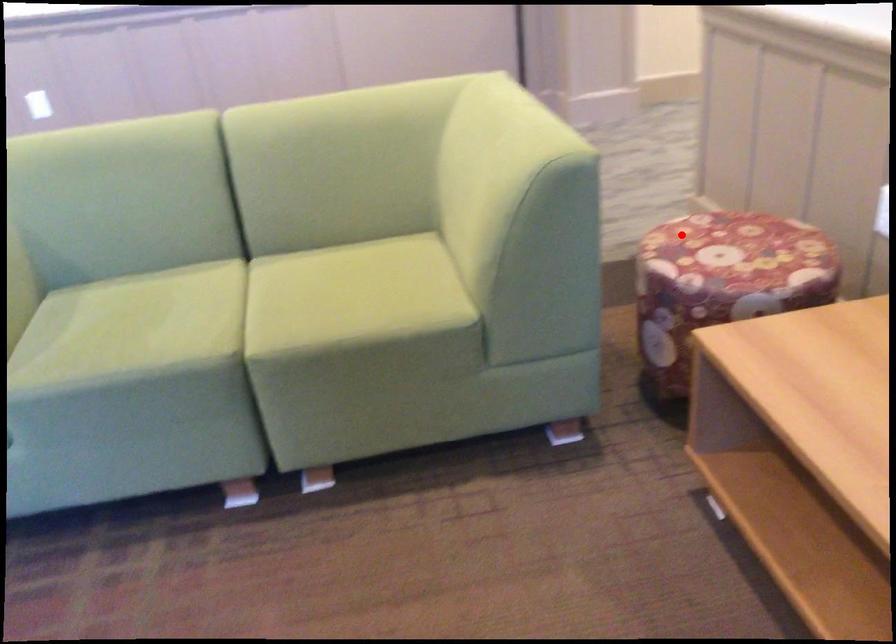
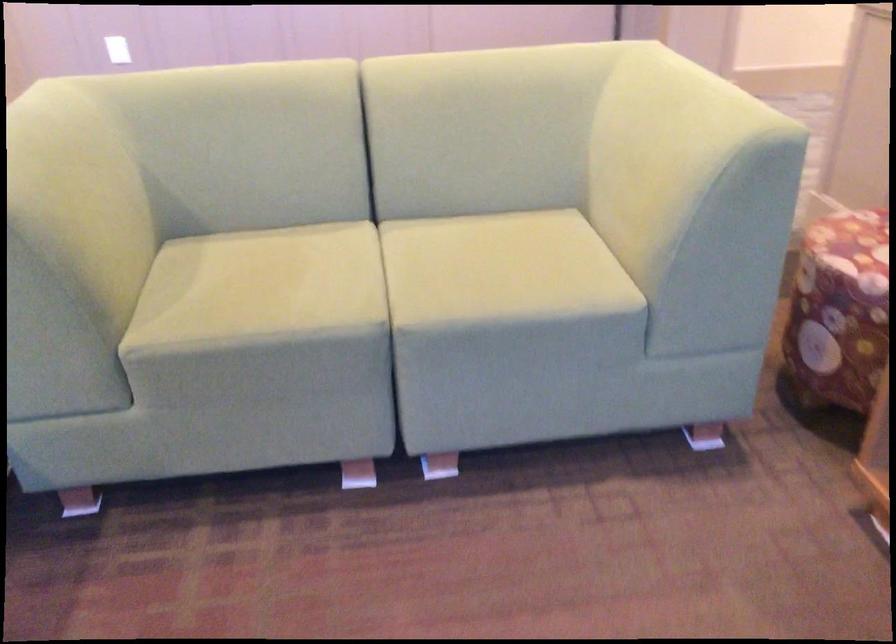
Locate, in the second image, the point that corresponds to the highlighted location in the first image.

(851, 231)